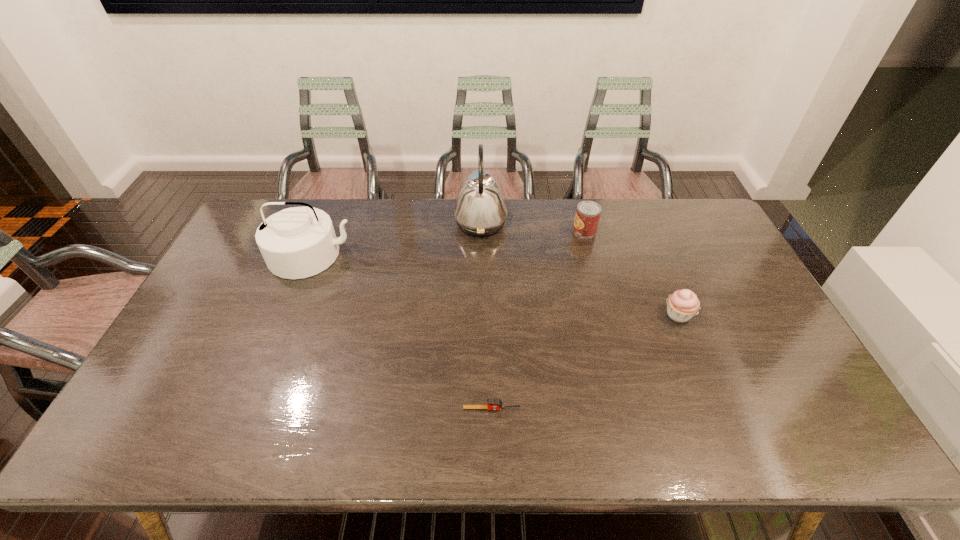
Where is `free space between the nearest object and the fourth object from left to right`? free space between the nearest object and the fourth object from left to right is located at coordinates (539, 320).

At what (x,y) coordinates should I click in order to perform the action: click on free space between the fourth shortest object and the cupcake. Please return your answer as a coordinate pair (x, y). The width and height of the screenshot is (960, 540). Looking at the image, I should click on (495, 285).

Locate an element on the screen. This screenshot has height=540, width=960. vacant area between the taller kettle and the leftmost object is located at coordinates (396, 239).

Identify which object is the fourth nearest to the tallest object. Please provide its 2D coordinates. Your answer should be formatted as a tuple, i.e. [(x, y)], where the tuple contains the x and y coordinates of a point satisfying the conditions above.

[(492, 403)]

Locate an element on the screen. This screenshot has height=540, width=960. object that is the closest to the second tallest object is located at coordinates (480, 210).

Where is `free space that satisfies the following two spatial constraints: 1. from the spout of the taller kettle; 2. on the right side of the rightmost object`? Image resolution: width=960 pixels, height=540 pixels. free space that satisfies the following two spatial constraints: 1. from the spout of the taller kettle; 2. on the right side of the rightmost object is located at coordinates (481, 315).

Where is `free space in the image that satisfies the following two spatial constraints: 1. from the spout of the taller kettle; 2. on the back side of the rightmost object`? free space in the image that satisfies the following two spatial constraints: 1. from the spout of the taller kettle; 2. on the back side of the rightmost object is located at coordinates (481, 315).

Where is `free spot that satisfies the following two spatial constraints: 1. from the spout of the taller kettle; 2. on the back side of the can`? Image resolution: width=960 pixels, height=540 pixels. free spot that satisfies the following two spatial constraints: 1. from the spout of the taller kettle; 2. on the back side of the can is located at coordinates (481, 231).

The width and height of the screenshot is (960, 540). What are the coordinates of `free space that satisfies the following two spatial constraints: 1. on the spout of the fourth farthest object; 2. on the right side of the fourth shortest object` in the screenshot? It's located at (289, 315).

Identify the location of vacant space that satisfies the following two spatial constraints: 1. on the back side of the rightmost object; 2. from the spout of the taller kettle. (640, 223).